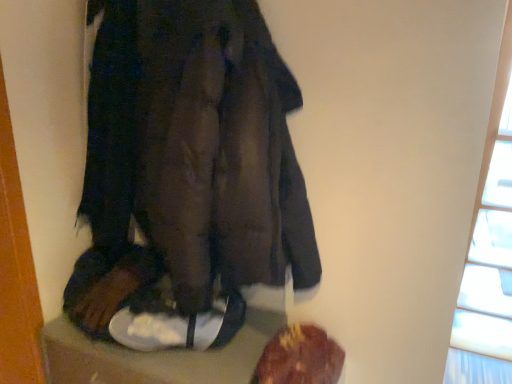
Question: Is transparent glass window at upper right looking in the opposite direction of brown crumbly bread at lower right?

Choices:
 (A) no
 (B) yes

Answer: (A)

Question: From the image's perspective, does transparent glass window at upper right appear lower than brown crumbly bread at lower right?

Choices:
 (A) no
 (B) yes

Answer: (A)

Question: Can you confirm if transparent glass window at upper right is positioned to the left of brown crumbly bread at lower right?

Choices:
 (A) yes
 (B) no

Answer: (B)

Question: From a real-world perspective, is transparent glass window at upper right below brown crumbly bread at lower right?

Choices:
 (A) no
 (B) yes

Answer: (A)

Question: Is brown crumbly bread at lower right a part of transparent glass window at upper right?

Choices:
 (A) no
 (B) yes

Answer: (A)

Question: From the image's perspective, relative to brown crumbly bread at lower right, is transparent glass window at upper right above or below?

Choices:
 (A) below
 (B) above

Answer: (B)

Question: Would you say transparent glass window at upper right is inside or outside brown crumbly bread at lower right?

Choices:
 (A) outside
 (B) inside

Answer: (A)

Question: Visually, is transparent glass window at upper right positioned to the left or to the right of brown crumbly bread at lower right?

Choices:
 (A) right
 (B) left

Answer: (A)

Question: From a real-world perspective, is transparent glass window at upper right positioned above or below brown crumbly bread at lower right?

Choices:
 (A) below
 (B) above

Answer: (B)

Question: From a real-world perspective, relative to dark brown leather coat at center, is transparent glass window at upper right vertically above or below?

Choices:
 (A) above
 (B) below

Answer: (B)

Question: Looking at the image, does transparent glass window at upper right seem bigger or smaller compared to dark brown leather coat at center?

Choices:
 (A) small
 (B) big

Answer: (B)

Question: Considering the relative positions of transparent glass window at upper right and dark brown leather coat at center in the image provided, is transparent glass window at upper right to the left or to the right of dark brown leather coat at center?

Choices:
 (A) right
 (B) left

Answer: (A)

Question: Is point (501, 196) positioned closer to the camera than point (136, 309)?

Choices:
 (A) closer
 (B) farther

Answer: (B)

Question: In terms of height, does dark brown leather coat at center look taller or shorter compared to brown crumbly bread at lower right?

Choices:
 (A) tall
 (B) short

Answer: (A)

Question: From the image's perspective, is dark brown leather coat at center above or below brown crumbly bread at lower right?

Choices:
 (A) below
 (B) above

Answer: (B)